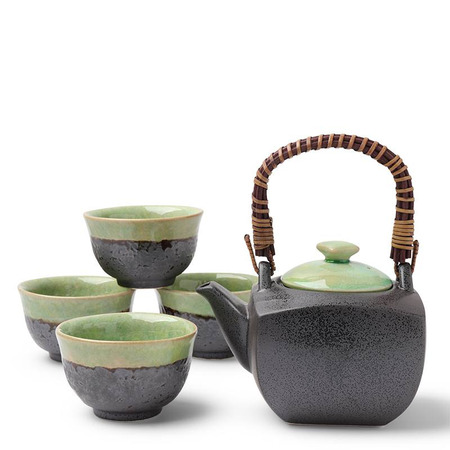
Where is `green kettle cover`? green kettle cover is located at coordinates (323, 270).